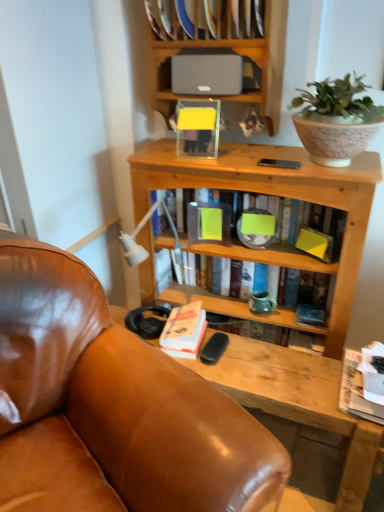
Question: Based on their sizes in the image, would you say brown leather chair at center is bigger or smaller than white paper at lower right, the 1th book positioned from the bottom?

Choices:
 (A) big
 (B) small

Answer: (A)

Question: From the image's perspective, relative to white paper at lower right, placed as the 4th book when sorted from top to bottom, is brown leather chair at center above or below?

Choices:
 (A) above
 (B) below

Answer: (B)

Question: Which is nearer to the matte green book at center, which is the first book from top to bottom?

Choices:
 (A) brown leather chair at center
 (B) matte gray speaker at upper center
 (C) white paper at lower right, placed as the 4th book when sorted from top to bottom
 (D) hardcover book at center, acting as the 2th book starting from the top
 (E) white matte book at center, the 2th book when ordered from bottom to top

Answer: (D)

Question: Which object is the farthest from the white matte book at center, the third book when ordered from top to bottom?

Choices:
 (A) brown leather chair at center
 (B) matte green book at center, which is the first book from top to bottom
 (C) satin gray speaker at upper center
 (D) hardcover book at center, marked as the 3th book in a bottom-to-top arrangement
 (E) matte gray speaker at upper center

Answer: (E)